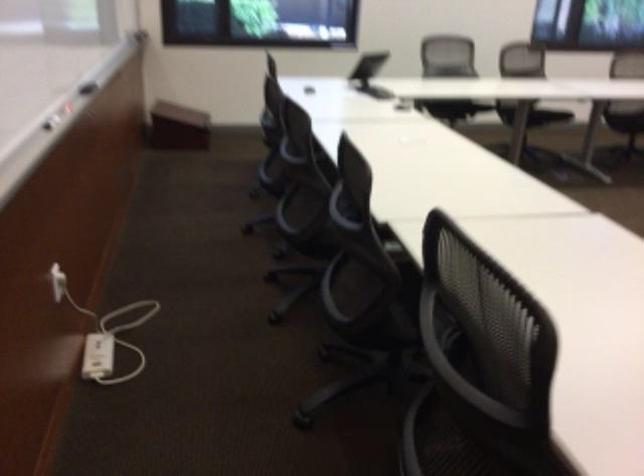
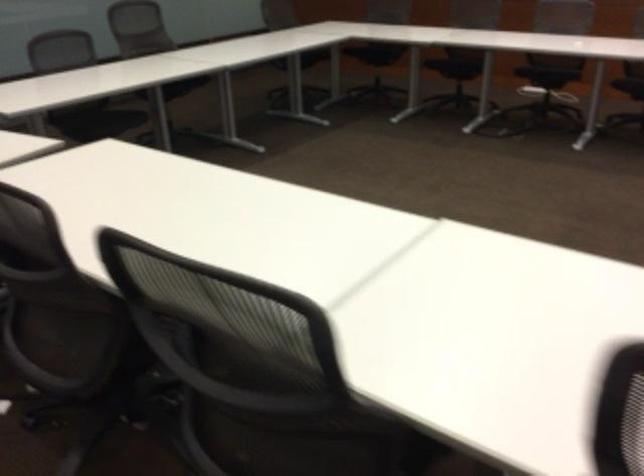
The images are taken continuously from a first-person perspective. In which direction is your viewpoint rotating?

The rotation direction of the camera is right-down.